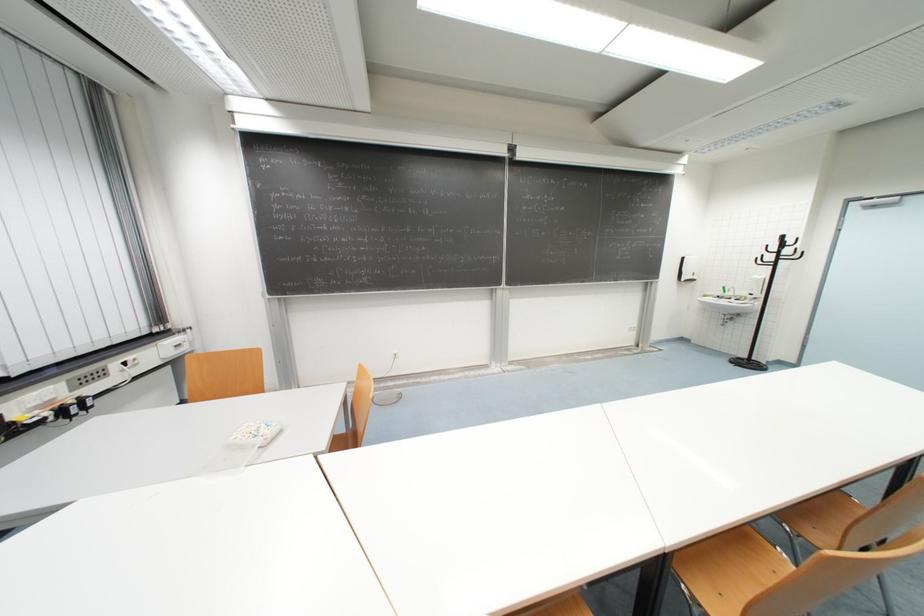
This screenshot has height=616, width=924. Find the location of `faucet handle`. faucet handle is located at coordinates pos(770,297).